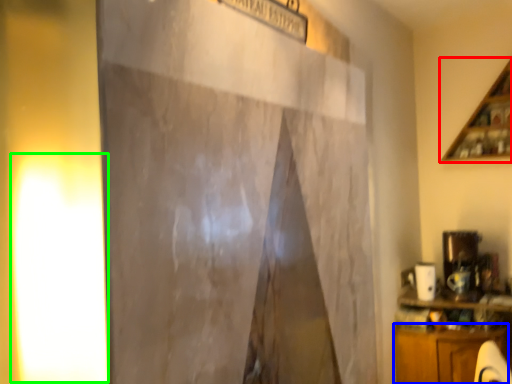
Question: Based on their relative distances, which object is nearer to shelf (highlighted by a red box)? Choose from cabinetry (highlighted by a blue box) and light (highlighted by a green box).

Choices:
 (A) cabinetry
 (B) light

Answer: (A)